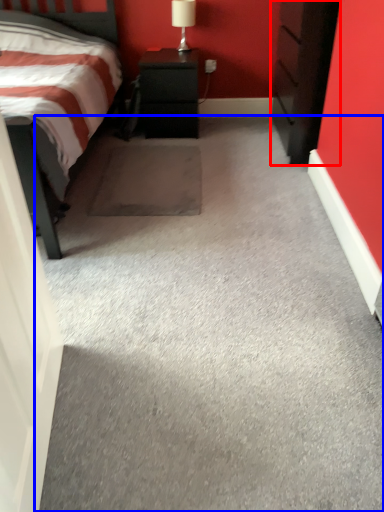
Question: Among these objects, which one is farthest to the camera, chest of drawers (highlighted by a red box) or concrete (highlighted by a blue box)?

Choices:
 (A) chest of drawers
 (B) concrete

Answer: (A)